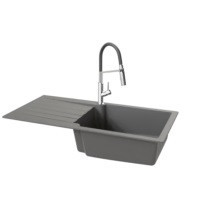
At what (x,y) coordinates should I click in order to perform the action: click on counter. Please return your answer as a coordinate pair (x, y). Looking at the image, I should click on (65, 110).